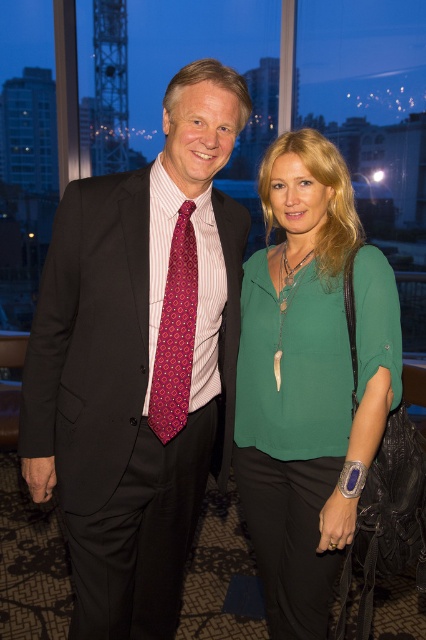
In the scene shown: Who is taller, green silk blouse at center or dark pink textured tie at center?

green silk blouse at center is taller.

Who is lower down, green silk blouse at center or dark pink textured tie at center?

green silk blouse at center

Is point (379, 438) positioned before point (164, 381)?

Yes, point (379, 438) is closer to viewer.

I want to click on green silk blouse at center, so click(x=310, y=380).

Who is higher up, matte black suit at center or green silk blouse at center?

matte black suit at center is higher up.

Is matte black suit at center thinner than green silk blouse at center?

No, matte black suit at center is not thinner than green silk blouse at center.

Is point (167, 428) closer to camera compared to point (302, 195)?

Yes.

Where is `matte black suit at center`? matte black suit at center is located at coordinates (138, 360).

Can you confirm if matte black suit at center is shorter than dark pink textured tie at center?

No.

Measure the distance between matte black suit at center and camera.

matte black suit at center is 1.27 meters from camera.

At what (x,y) coordinates should I click in order to perform the action: click on matte black suit at center. Please return your answer as a coordinate pair (x, y). Image resolution: width=426 pixels, height=640 pixels. Looking at the image, I should click on click(138, 360).